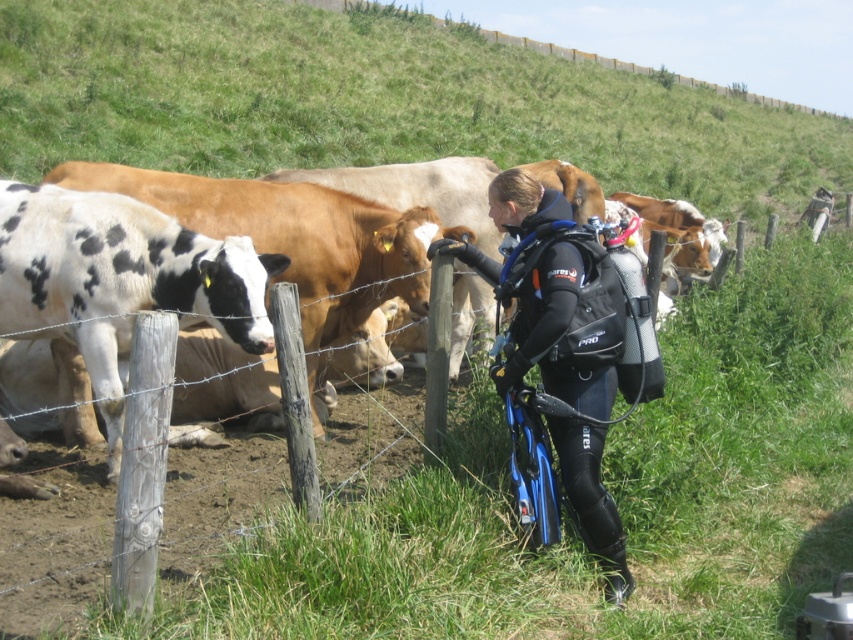
What are the coordinates of `wooden post at center` in the screenshot? It's located at (607, 486).

Can you confirm if wooden post at center is wider than black neoprene wetsuit at center?

No.

The width and height of the screenshot is (853, 640). I want to click on wooden post at center, so click(607, 486).

This screenshot has width=853, height=640. I want to click on wooden post at center, so click(x=607, y=486).